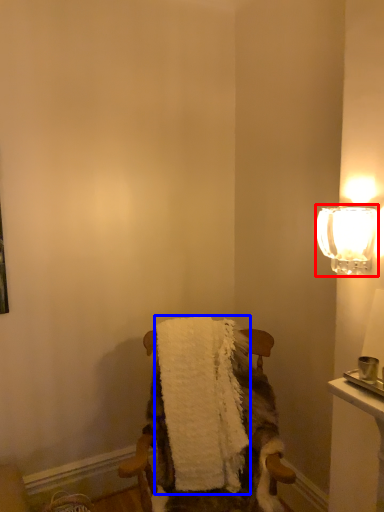
Question: Which of the following is the closest to the observer, lamp (highlighted by a red box) or bath towel (highlighted by a blue box)?

Choices:
 (A) lamp
 (B) bath towel

Answer: (A)